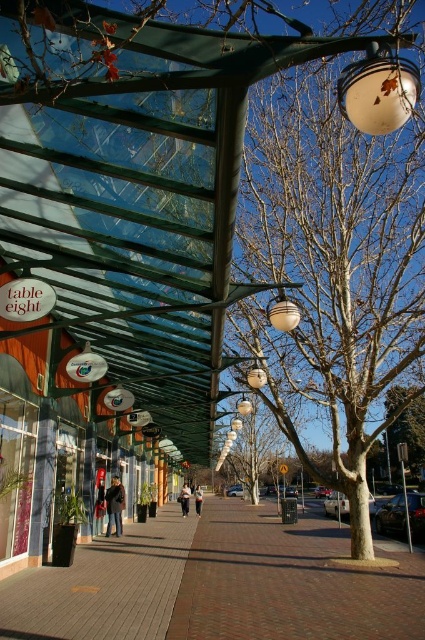
You are a delivery person carrying a heavy box and need to place it on the ground. You see the brown brick pavement at center and the white glass lamp at upper right. Which surface can you safely place your box?

The brown brick pavement at center is positioned under the white glass lamp at upper right, so you can safely place your box on the brown brick pavement at center since it is a solid surface, while the white glass lamp at upper right is hanging and not suitable for placing heavy items.

You are a delivery person carrying a large box that is 1.5 meters wide. You need to walk through the walkway shown in the image. Can you pass through the space between the brown brick pavement at center and the white glass lamp at upper right without tilting the box?

The brown brick pavement at center is bigger than the white glass lamp at upper right, but the question is about the space between them. The description does not provide information about the distance between the two objects, so it is unclear if the 1.5 meter wide box can fit. Additional spatial details are needed to determine this.